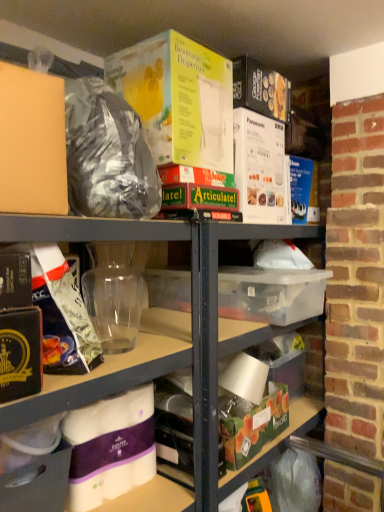
Question: From a real-world perspective, is transparent plastic storage box at center, the 1th storage box viewed from the top, located higher than transparent plastic jar at center, which is the second yoghurt from bottom to top?

Choices:
 (A) yes
 (B) no

Answer: (B)

Question: From the image's perspective, would you say transparent plastic storage box at center, placed as the second storage box when sorted from left to right, is shown under transparent plastic jar at center, positioned as the second yoghurt in top-to-bottom order?

Choices:
 (A) yes
 (B) no

Answer: (A)

Question: Is transparent plastic storage box at center, the 1th storage box viewed from the top, to the right of transparent plastic jar at center, positioned as the second yoghurt in top-to-bottom order, from the viewer's perspective?

Choices:
 (A) yes
 (B) no

Answer: (A)

Question: Is transparent plastic storage box at center, acting as the second storage box starting from the right, aimed at transparent plastic jar at center, which is the second yoghurt from bottom to top?

Choices:
 (A) yes
 (B) no

Answer: (B)

Question: Is transparent plastic storage box at center, placed as the second storage box when sorted from left to right, shorter than transparent plastic jar at center, positioned as the second yoghurt in top-to-bottom order?

Choices:
 (A) yes
 (B) no

Answer: (A)

Question: Is transparent plastic storage box at center, acting as the second storage box starting from the right, looking in the opposite direction of transparent plastic jar at center, which is the second yoghurt from bottom to top?

Choices:
 (A) no
 (B) yes

Answer: (A)

Question: Considering the relative sizes of shiny metallic bag at upper left and green matte storage box at lower center, the 3th storage box positioned from the left, in the image provided, is shiny metallic bag at upper left shorter than green matte storage box at lower center, the 3th storage box positioned from the left,?

Choices:
 (A) yes
 (B) no

Answer: (B)

Question: Is shiny metallic bag at upper left thinner than green matte storage box at lower center, placed as the 1th storage box when sorted from right to left?

Choices:
 (A) yes
 (B) no

Answer: (B)

Question: From a real-world perspective, is shiny metallic bag at upper left physically above green matte storage box at lower center, the 3th storage box positioned from the left?

Choices:
 (A) yes
 (B) no

Answer: (A)

Question: Is shiny metallic bag at upper left to the left of green matte storage box at lower center, the 3th storage box positioned from the left, from the viewer's perspective?

Choices:
 (A) no
 (B) yes

Answer: (B)

Question: Is shiny metallic bag at upper left not close to green matte storage box at lower center, positioned as the second storage box in top-to-bottom order?

Choices:
 (A) yes
 (B) no

Answer: (B)

Question: Can we say shiny metallic bag at upper left lies outside green matte storage box at lower center, placed as the 1th storage box when sorted from right to left?

Choices:
 (A) no
 (B) yes

Answer: (B)

Question: Considering the relative sizes of shiny metallic bag at upper left and transparent plastic storage box at center, the 1th storage box viewed from the top, in the image provided, is shiny metallic bag at upper left smaller than transparent plastic storage box at center, the 1th storage box viewed from the top,?

Choices:
 (A) no
 (B) yes

Answer: (B)